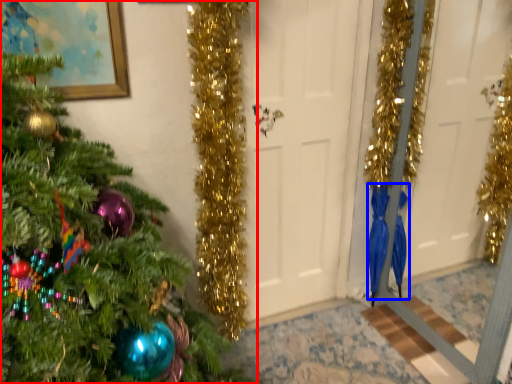
Question: Which of the following is the closest to the observer, christmas tree (highlighted by a red box) or robe (highlighted by a blue box)?

Choices:
 (A) christmas tree
 (B) robe

Answer: (A)